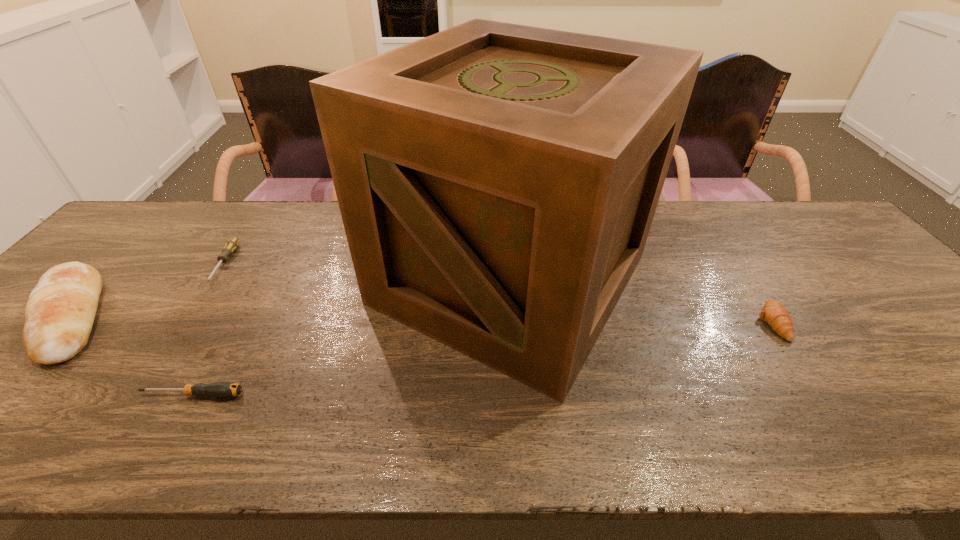
This screenshot has height=540, width=960. What are the coordinates of `the tallest object` in the screenshot? It's located at (497, 182).

The width and height of the screenshot is (960, 540). I want to click on box, so click(497, 182).

Locate an element on the screen. the rightmost object is located at coordinates (778, 318).

This screenshot has height=540, width=960. Find the location of `the farther screwdriver`. the farther screwdriver is located at coordinates (231, 245).

This screenshot has width=960, height=540. I want to click on the nearer screwdriver, so click(x=217, y=389).

I want to click on blank area located 0.250m on the left of the tallest object, so click(x=277, y=280).

The height and width of the screenshot is (540, 960). Identify the location of free space located on the back of the rightmost object. (732, 259).

Find the location of a particular element. free point located at the tip of the farther screwdriver is located at coordinates (177, 336).

Image resolution: width=960 pixels, height=540 pixels. In order to click on vacant space situated 0.060m on the back of the nearer screwdriver in this screenshot , I will do `click(209, 365)`.

Image resolution: width=960 pixels, height=540 pixels. What are the coordinates of `box present at the far edge` in the screenshot? It's located at (497, 182).